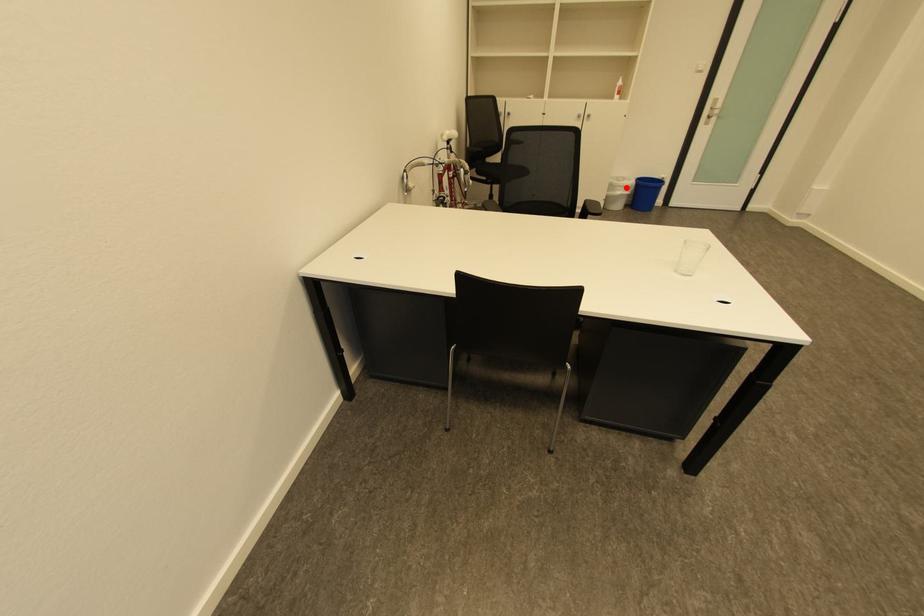
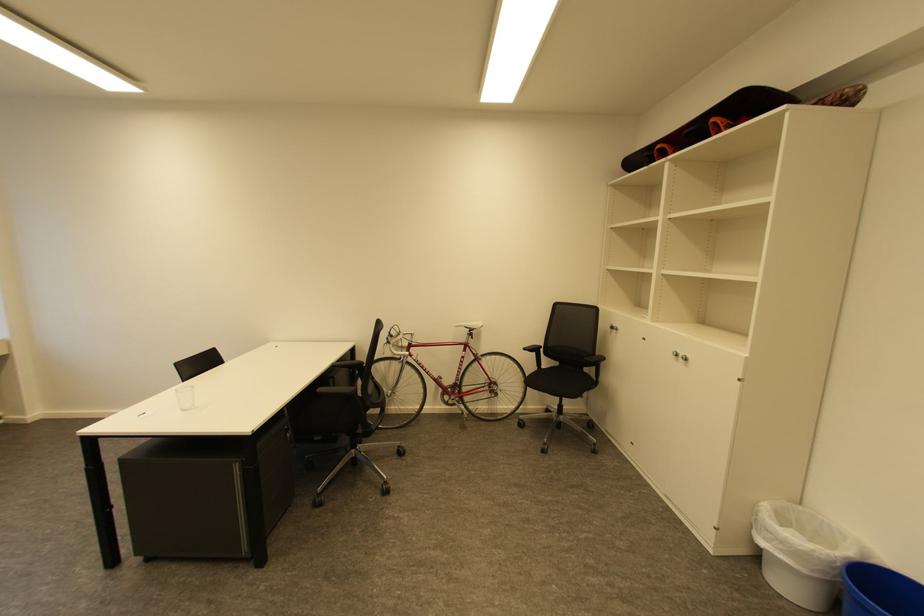
Question: I am providing you with two images of the same scene from different viewpoints. Given a red point in image1, look at the same physical point in image2. Is it:

Choices:
 (A) Closer to the viewpoint
 (B) Farther from the viewpoint

Answer: (B)